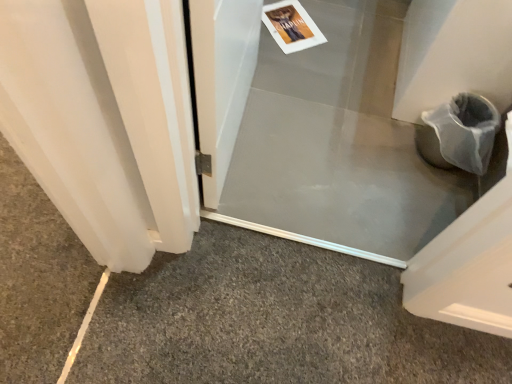
Where is `vacant space in clear plastic screen door at center, marked as the 1th screen door in a front-to-back arrangement (from a real-world perspective)`? This screenshot has height=384, width=512. vacant space in clear plastic screen door at center, marked as the 1th screen door in a front-to-back arrangement (from a real-world perspective) is located at coordinates (242, 129).